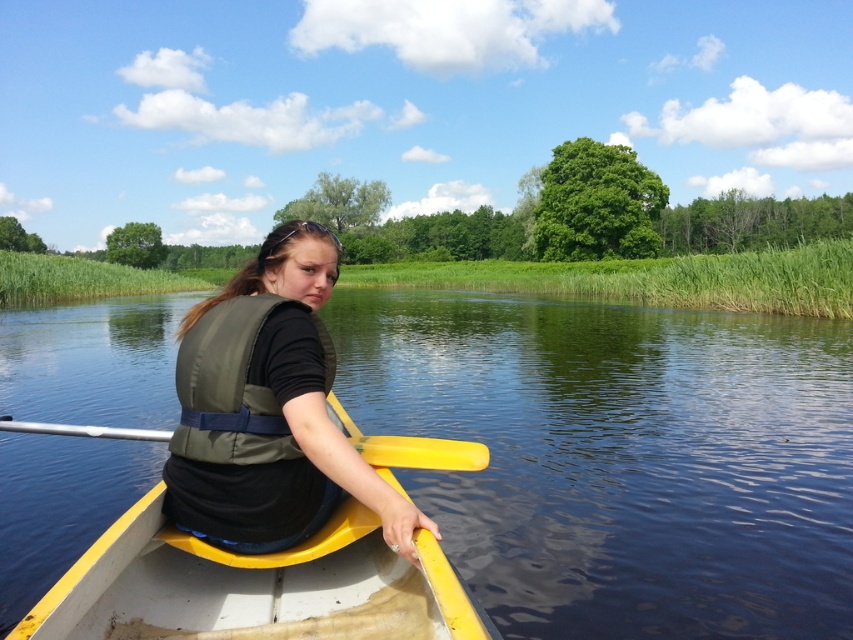
Who is positioned more to the left, olive green life vest at center or yellow plastic paddle at center?

yellow plastic paddle at center

What do you see at coordinates (271, 410) in the screenshot?
I see `olive green life vest at center` at bounding box center [271, 410].

Locate an element on the screen. This screenshot has height=640, width=853. olive green life vest at center is located at coordinates (271, 410).

Which of these two, clear water at center or yellow plastic boat at center, stands shorter?

yellow plastic boat at center is shorter.

Can you confirm if clear water at center is positioned above yellow plastic boat at center?

Yes, clear water at center is above yellow plastic boat at center.

Find the location of a particular element. clear water at center is located at coordinates (619, 458).

Consider the image. Is the position of yellow plastic boat at center less distant than that of olive green life vest at center?

Yes, it is in front of olive green life vest at center.

Is yellow plastic boat at center shorter than olive green life vest at center?

Yes.

What do you see at coordinates (253, 586) in the screenshot? This screenshot has width=853, height=640. I see `yellow plastic boat at center` at bounding box center [253, 586].

This screenshot has height=640, width=853. I want to click on yellow plastic boat at center, so click(x=253, y=586).